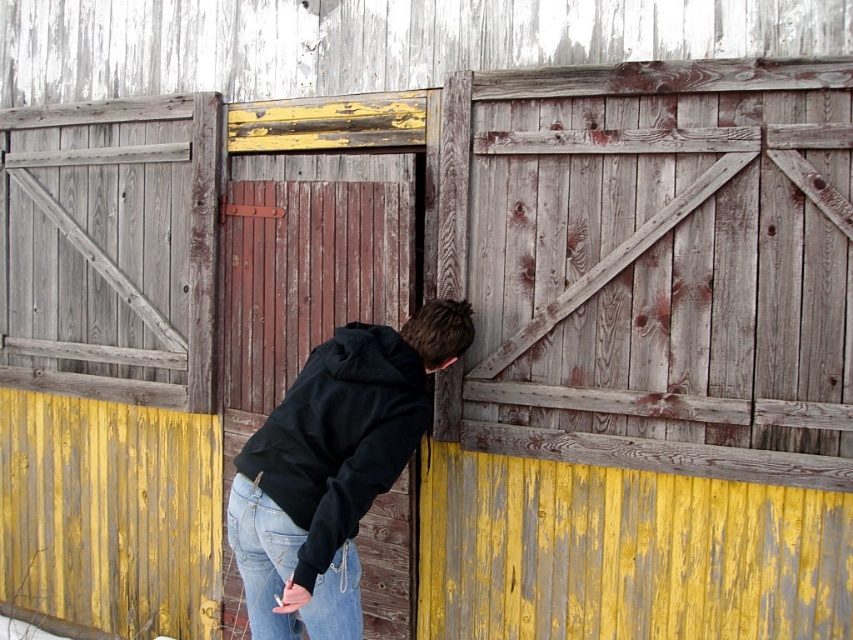
You are trying to decide whether to hang a black fleece sweatshirt at center on a hook near the weathered wood door at center. Considering their sizes, will the sweatshirt fit without touching the door?

The weathered wood door at center is larger than the black fleece sweatshirt at center, so the sweatshirt should fit on the hook near the door without touching it.

You are standing in front of the wooden structure and notice the weathered wood door at center and the jeans at lower center. Which object is positioned higher from the ground?

The weathered wood door at center is located above jeans at lower center, so it is positioned higher from the ground.